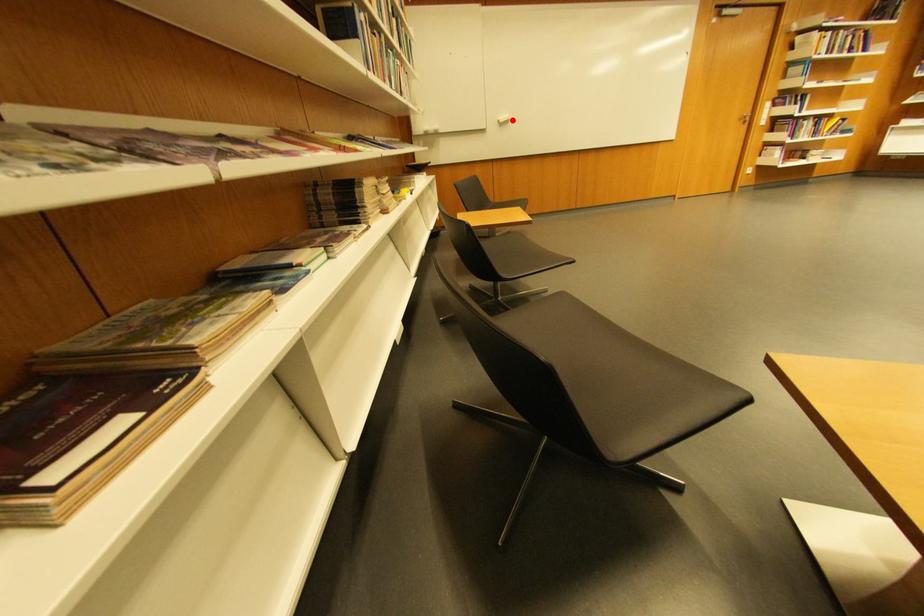
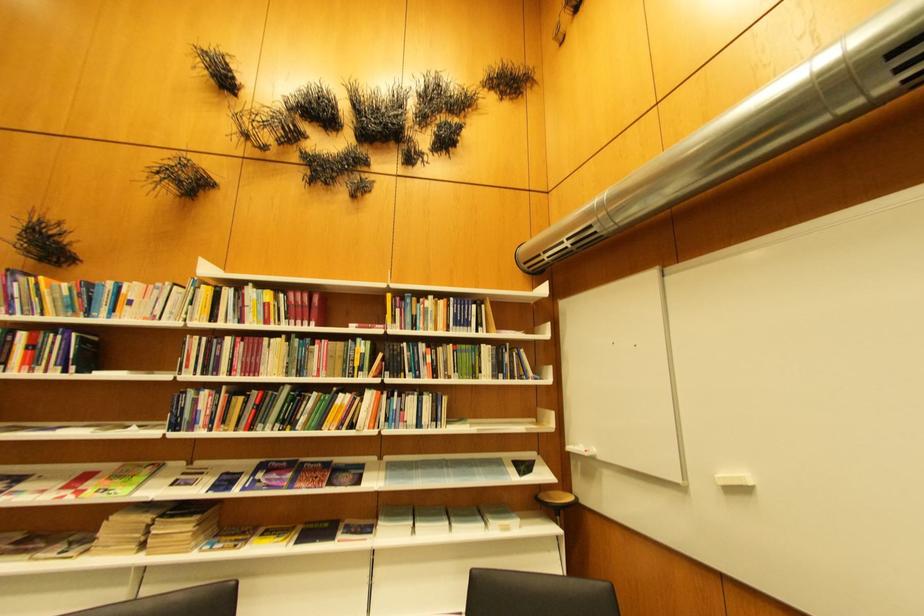
Question: I am providing you with two images of the same scene from different viewpoints. Image1 has a red point marked. In image2, the corresponding 3D location appears at what relative position? Reply with the corresponding letter.

Choices:
 (A) Closer
 (B) Farther

Answer: (B)